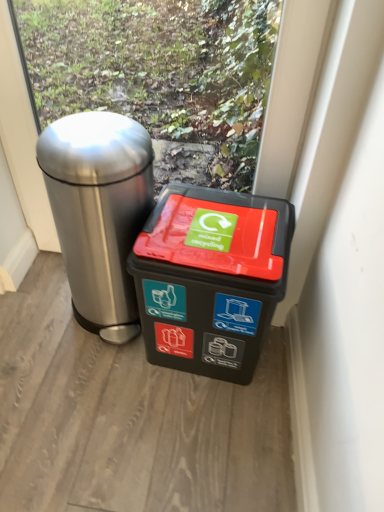
Identify the location of vacant space that is to the left of polished stainless steel trash can at left, marked as the 1th waste container in a left-to-right arrangement. (35, 305).